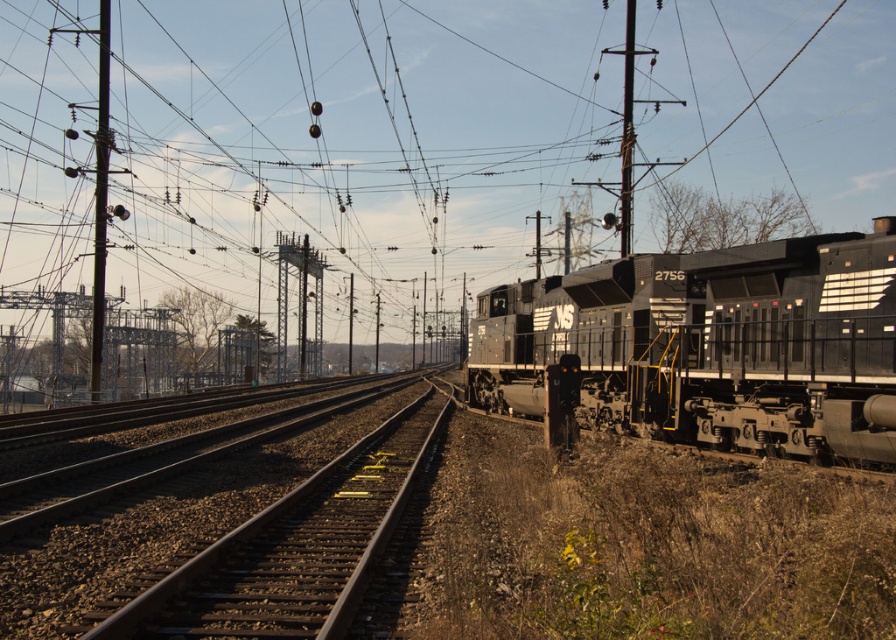
You are a railway worker standing at the metallic gray pole at left. You need to cross to the brown gravel track at center. Which direction should you walk to reach the track?

The brown gravel track at center is positioned on the right side of metallic gray pole at left, so you should walk to the right to reach the track.

You are standing at the point labeled point [617,340] and want to walk to the point labeled point [95,381]. Given that the distance between them is 10 meters, can you safely walk directly between them without crossing the railway tracks?

The point labeled point [617,340] is closer to the camera than point [95,381]. Since the railway tracks curve gently to the left in the foreground and converge into the distance, the path between them may cross the tracks. However, without specific information about the terrain or obstacles between them, it is not possible to confirm safety. Please check for any tracks or obstacles before proceeding.

You are a railway inspector standing at the edge of the tracks. You need to walk from the matte black locomotive at center to the brown gravel track at center to inspect them both. Which one is closer to you?

Both the matte black locomotive at center and the brown gravel track at center are exactly 5.79 meters apart from each other, so they are equidistant from your current position.